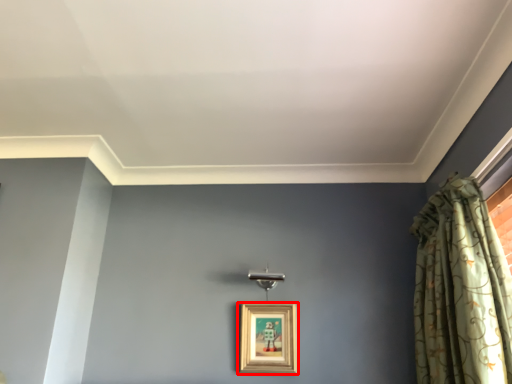
Question: Considering the relative positions of picture frame (annotated by the red box) and curtain in the image provided, where is picture frame (annotated by the red box) located with respect to the staircase?

Choices:
 (A) right
 (B) left

Answer: (B)